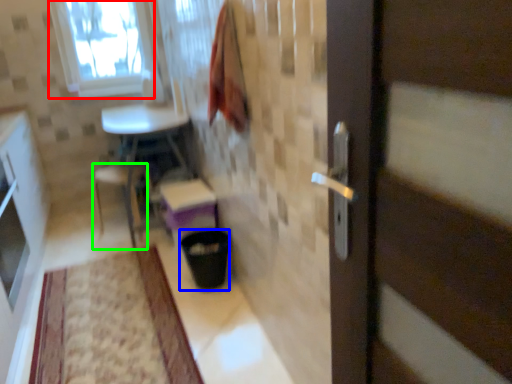
Question: Estimate the real-world distances between objects in this image. Which object is farther from window (highlighted by a red box), trash bin/can (highlighted by a blue box) or chair (highlighted by a green box)?

Choices:
 (A) trash bin/can
 (B) chair

Answer: (A)